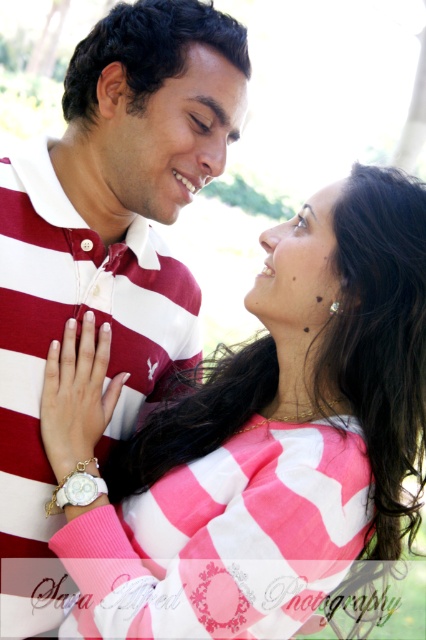
Does pink striped sweater at center lie behind maroon striped polo shirt at center?

No.

Which of these two, pink striped sweater at center or maroon striped polo shirt at center, stands shorter?

pink striped sweater at center

What are the coordinates of `pink striped sweater at center` in the screenshot? It's located at (256, 436).

I want to click on pink striped sweater at center, so click(x=256, y=436).